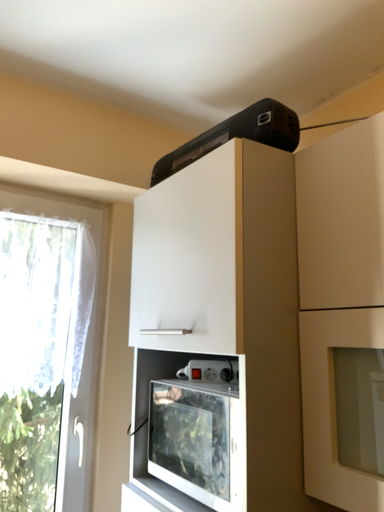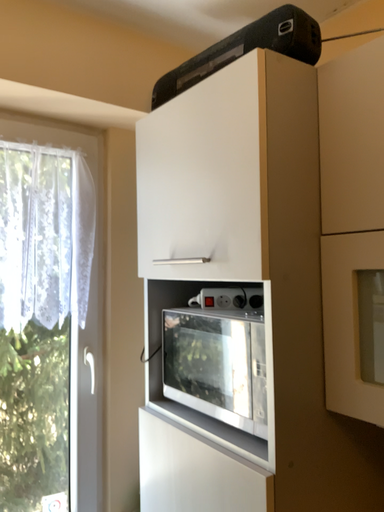
Question: Which way did the camera rotate in the video?

Choices:
 (A) rotated downward
 (B) rotated upward

Answer: (A)